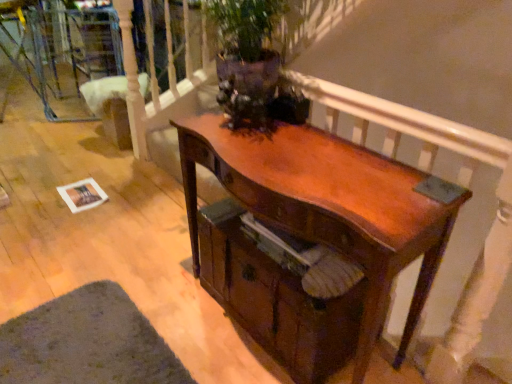
At what (x,y) coordinates should I click in order to perform the action: click on vacant space underneath green felt mat at lower left (from a real-world perspective). Please return your answer as a coordinate pair (x, y). The height and width of the screenshot is (384, 512). Looking at the image, I should click on (84, 349).